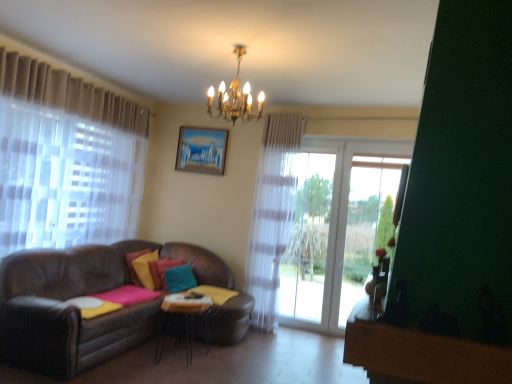
Question: Is gold metallic chandelier at upper center at the right side of matte wooden picture frame at upper center?

Choices:
 (A) no
 (B) yes

Answer: (B)

Question: From the image's perspective, is gold metallic chandelier at upper center on top of matte wooden picture frame at upper center?

Choices:
 (A) yes
 (B) no

Answer: (A)

Question: From a real-world perspective, is gold metallic chandelier at upper center on top of matte wooden picture frame at upper center?

Choices:
 (A) no
 (B) yes

Answer: (B)

Question: Is gold metallic chandelier at upper center placed right next to matte wooden picture frame at upper center?

Choices:
 (A) no
 (B) yes

Answer: (A)

Question: Considering the relative sizes of gold metallic chandelier at upper center and matte wooden picture frame at upper center in the image provided, is gold metallic chandelier at upper center wider than matte wooden picture frame at upper center?

Choices:
 (A) no
 (B) yes

Answer: (B)

Question: Considering the relative sizes of gold metallic chandelier at upper center and matte wooden picture frame at upper center in the image provided, is gold metallic chandelier at upper center smaller than matte wooden picture frame at upper center?

Choices:
 (A) yes
 (B) no

Answer: (B)

Question: Is matte wooden picture frame at upper center located within teal matte pillow at center, which is the 1th pillow from right to left?

Choices:
 (A) no
 (B) yes

Answer: (A)

Question: Considering the relative positions of teal matte pillow at center, which is the 1th pillow from right to left, and matte wooden picture frame at upper center in the image provided, is teal matte pillow at center, which is the 1th pillow from right to left, to the left of matte wooden picture frame at upper center from the viewer's perspective?

Choices:
 (A) yes
 (B) no

Answer: (A)

Question: From a real-world perspective, is teal matte pillow at center, which is the 1th pillow from right to left, located higher than matte wooden picture frame at upper center?

Choices:
 (A) no
 (B) yes

Answer: (A)

Question: Is teal matte pillow at center, which is the 1th pillow from right to left, positioned with its back to matte wooden picture frame at upper center?

Choices:
 (A) no
 (B) yes

Answer: (A)

Question: Is teal matte pillow at center, which is the 1th pillow from right to left, completely or partially outside of matte wooden picture frame at upper center?

Choices:
 (A) no
 (B) yes

Answer: (B)

Question: Considering the relative sizes of teal matte pillow at center, arranged as the third pillow when viewed from the left, and matte wooden picture frame at upper center in the image provided, is teal matte pillow at center, arranged as the third pillow when viewed from the left, wider than matte wooden picture frame at upper center?

Choices:
 (A) no
 (B) yes

Answer: (B)

Question: Considering the relative sizes of matte wooden picture frame at upper center and velvet yellow pillow at center, the 1th pillow positioned from the left, in the image provided, is matte wooden picture frame at upper center smaller than velvet yellow pillow at center, the 1th pillow positioned from the left,?

Choices:
 (A) yes
 (B) no

Answer: (A)